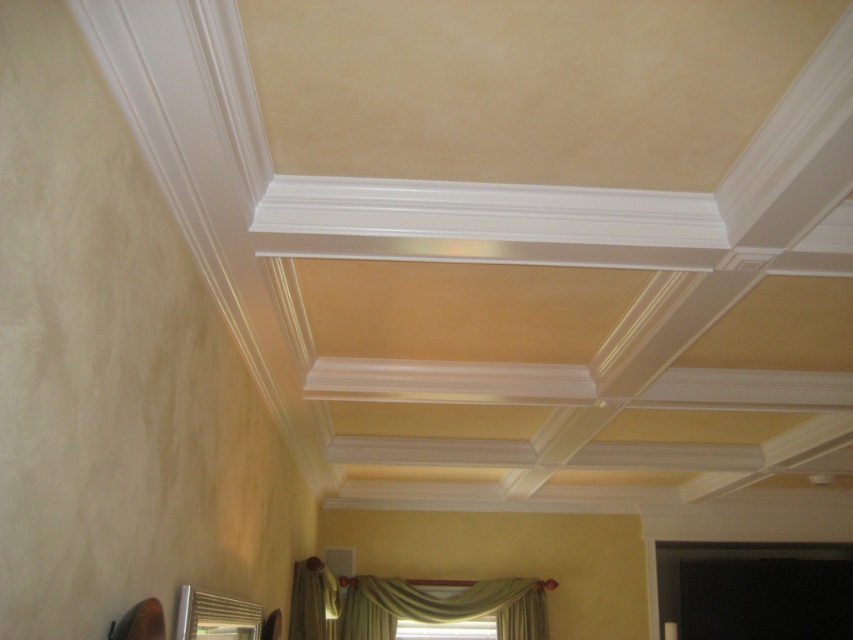
You are a decorator trying to decide which curtain to keep. Both the green fabric curtain at lower center and the green velvet curtain at lower center are in the same spot. Which one is wider?

The green fabric curtain at lower center might be wider than the green velvet curtain at lower center.

Consider the image. You are standing in the room and want to know which curtain is shorter between the green fabric curtain at lower center and the green velvet curtain at lower center. Can you determine that?

The green fabric curtain at lower center is not as tall as the green velvet curtain at lower center, so the green fabric curtain at lower center is shorter.